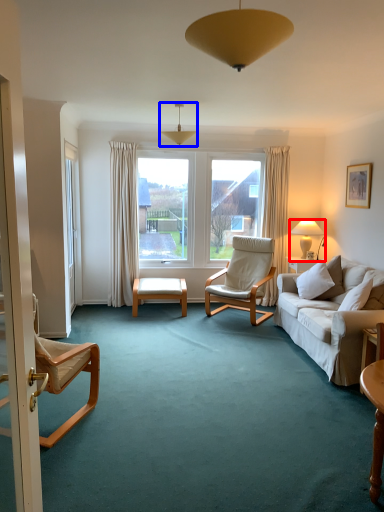
Question: Which point is closer to the camera, lamp (highlighted by a red box) or lamp (highlighted by a blue box)?

Choices:
 (A) lamp
 (B) lamp

Answer: (B)